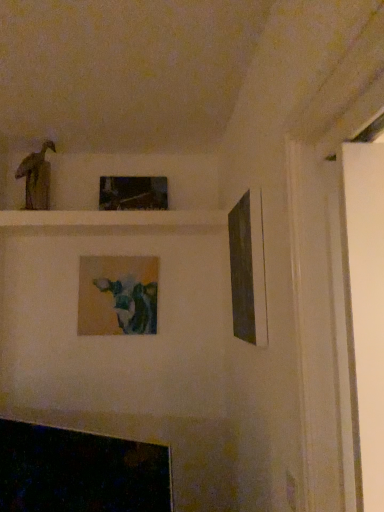
Question: Is matte black picture frame at right, which is the third picture frame from back to front, at the back of matte brown statue at upper left?

Choices:
 (A) no
 (B) yes

Answer: (A)

Question: Is matte brown statue at upper left facing towards matte black picture frame at right, which is the third picture frame from back to front?

Choices:
 (A) yes
 (B) no

Answer: (B)

Question: Considering the relative positions of matte brown statue at upper left and matte black picture frame at right, which is the first picture frame from front to back, in the image provided, is matte brown statue at upper left in front of matte black picture frame at right, which is the first picture frame from front to back,?

Choices:
 (A) no
 (B) yes

Answer: (A)

Question: Considering the relative sizes of matte brown statue at upper left and matte black picture frame at right, arranged as the first picture frame when viewed from the right, in the image provided, is matte brown statue at upper left smaller than matte black picture frame at right, arranged as the first picture frame when viewed from the right,?

Choices:
 (A) yes
 (B) no

Answer: (A)

Question: From a real-world perspective, is matte brown statue at upper left on matte black picture frame at right, arranged as the first picture frame when viewed from the right?

Choices:
 (A) yes
 (B) no

Answer: (A)

Question: Would you say matte black picture frame at right, the 3th picture frame positioned from the left, is inside or outside metallic reflective frame at upper center, placed as the 2th picture frame when sorted from right to left?

Choices:
 (A) outside
 (B) inside

Answer: (A)

Question: From a real-world perspective, is matte black picture frame at right, which is the third picture frame from back to front, positioned above or below metallic reflective frame at upper center, which is the 2th picture frame from left to right?

Choices:
 (A) above
 (B) below

Answer: (B)

Question: Looking at their shapes, would you say matte black picture frame at right, which is the third picture frame from back to front, is wider or thinner than metallic reflective frame at upper center, which is the 3th picture frame in front-to-back order?

Choices:
 (A) wide
 (B) thin

Answer: (B)

Question: In terms of height, does matte black picture frame at right, the 3th picture frame positioned from the left, look taller or shorter compared to metallic reflective frame at upper center, the first picture frame in the back-to-front sequence?

Choices:
 (A) short
 (B) tall

Answer: (B)

Question: Is matte brown statue at upper left to the left or to the right of matte wooden picture frame at center, the 2th picture frame from the front, in the image?

Choices:
 (A) left
 (B) right

Answer: (A)

Question: Relative to matte wooden picture frame at center, which is the 3th picture frame in right-to-left order, is matte brown statue at upper left in front or behind?

Choices:
 (A) behind
 (B) front

Answer: (B)

Question: Considering the positions of matte brown statue at upper left and matte wooden picture frame at center, which is the 3th picture frame in right-to-left order, in the image, is matte brown statue at upper left wider or thinner than matte wooden picture frame at center, which is the 3th picture frame in right-to-left order,?

Choices:
 (A) thin
 (B) wide

Answer: (B)

Question: From the image's perspective, is matte brown statue at upper left positioned above or below matte wooden picture frame at center, the 2th picture frame from the front?

Choices:
 (A) below
 (B) above

Answer: (B)

Question: Looking at their shapes, would you say matte wooden picture frame at center, which is the 3th picture frame in right-to-left order, is wider or thinner than metallic reflective frame at upper center, which is the 3th picture frame in front-to-back order?

Choices:
 (A) wide
 (B) thin

Answer: (B)

Question: Is matte wooden picture frame at center, which is the 3th picture frame in right-to-left order, taller or shorter than metallic reflective frame at upper center, which is the 3th picture frame in front-to-back order?

Choices:
 (A) tall
 (B) short

Answer: (A)